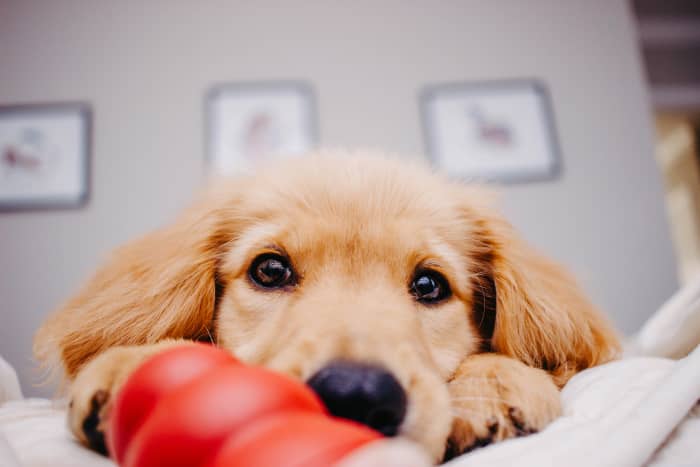
At what (x,y) coordinates should I click in order to perform the action: click on white blanket. Please return your answer as a coordinate pair (x, y). Image resolution: width=700 pixels, height=467 pixels. Looking at the image, I should click on (673, 398).